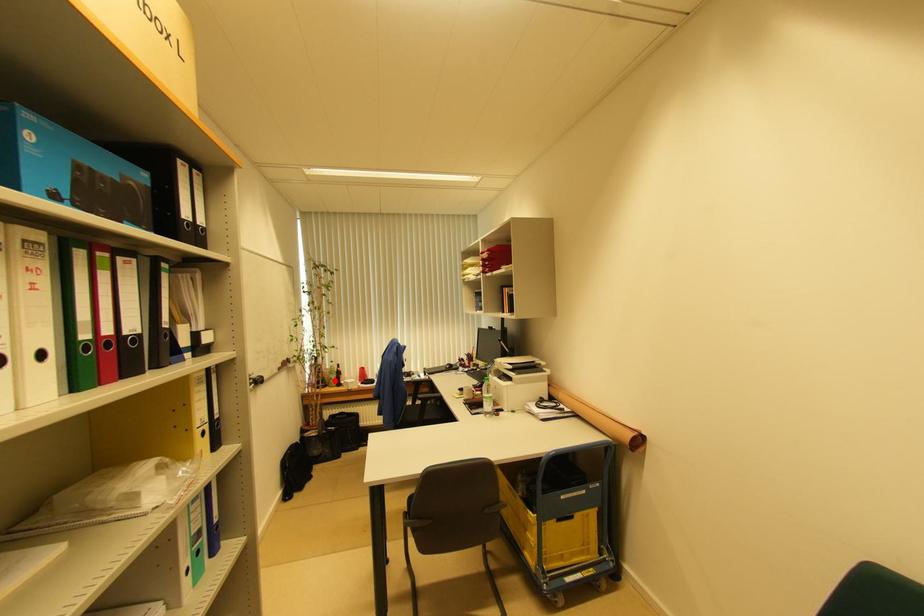
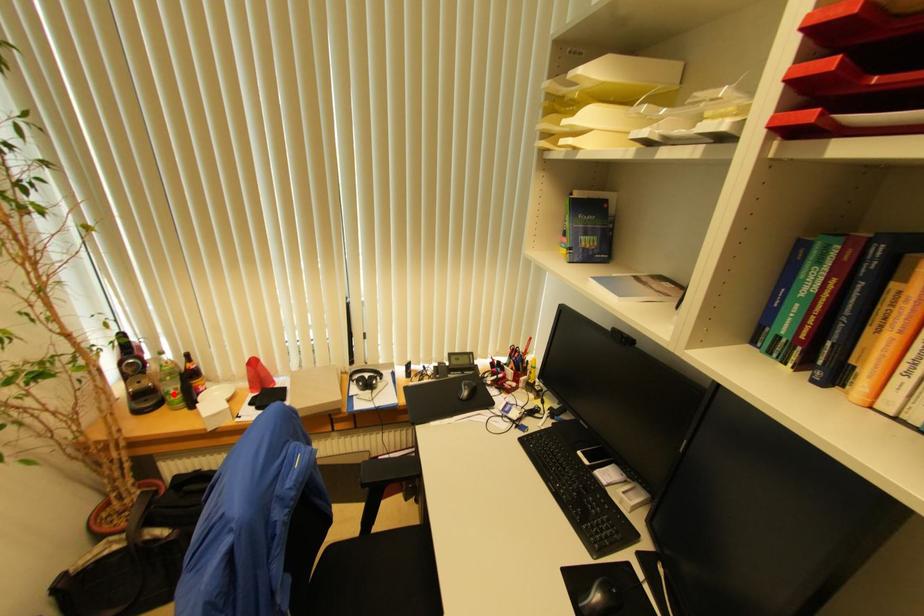
I am providing you with two images of the same scene from different viewpoints. A red point is marked on the first image and another point is marked on the second image. Is the marked point in image1 the same physical position as the marked point in image2?

Yes